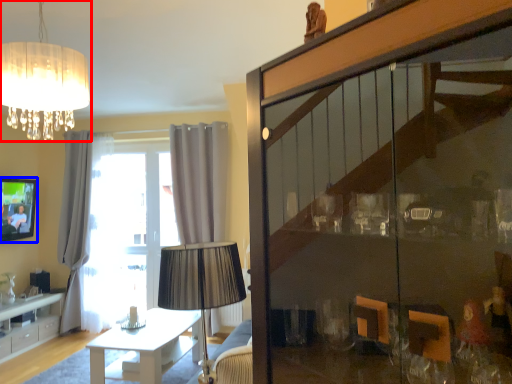
Question: Among these objects, which one is nearest to the camera, lamp (highlighted by a red box) or picture frame (highlighted by a blue box)?

Choices:
 (A) lamp
 (B) picture frame

Answer: (A)